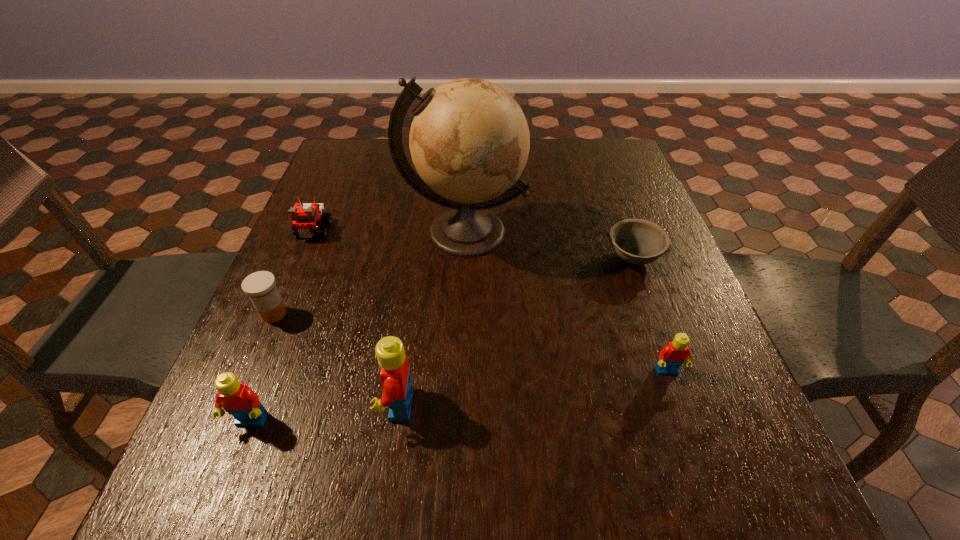
Where is `vacant point at the far edge`? The width and height of the screenshot is (960, 540). vacant point at the far edge is located at coordinates (543, 164).

In the image, there is a desktop. Where is `vacant space at the near edge`? vacant space at the near edge is located at coordinates (554, 441).

In the image, there is a desktop. Where is `blank space at the left edge`? The width and height of the screenshot is (960, 540). blank space at the left edge is located at coordinates (327, 197).

Find the location of a particular element. This screenshot has width=960, height=540. vacant space at the right edge is located at coordinates (633, 281).

You are a GUI agent. You are given a task and a screenshot of the screen. Output one action in this format:
    pyautogui.click(x=<x>, y=<y>)
    Task: Click on the vacant space at the far left corner
    The height and width of the screenshot is (540, 960).
    Given the screenshot: What is the action you would take?
    pyautogui.click(x=327, y=176)

Where is `free space at the near left corner of the desktop`? free space at the near left corner of the desktop is located at coordinates (295, 417).

Where is `vacant point located between the rightmost Lego and the tallest object`? The height and width of the screenshot is (540, 960). vacant point located between the rightmost Lego and the tallest object is located at coordinates point(565,302).

Locate an element on the screen. The height and width of the screenshot is (540, 960). vacant space that's between the fourth farthest object and the third tallest object is located at coordinates (262, 368).

This screenshot has width=960, height=540. I want to click on empty location between the medicine and the second tallest Lego, so click(262, 368).

This screenshot has width=960, height=540. In order to click on unoccupied area between the shortest object and the rightmost Lego in this screenshot , I will do `click(650, 315)`.